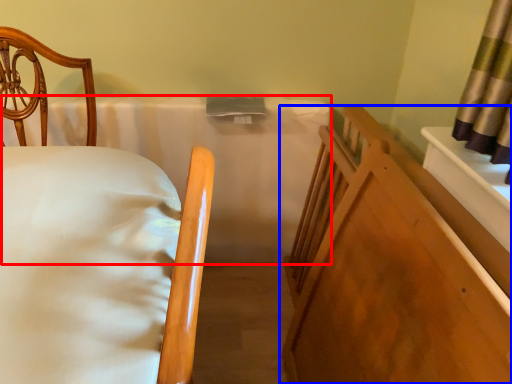
Question: Which object is closer to the camera taking this photo, mattress (highlighted by a red box) or furniture (highlighted by a blue box)?

Choices:
 (A) mattress
 (B) furniture

Answer: (B)